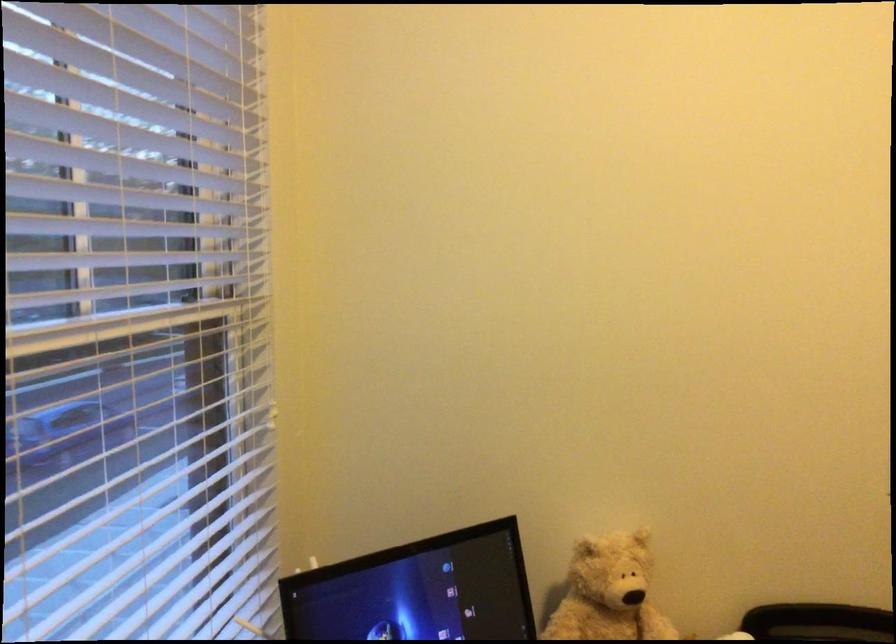
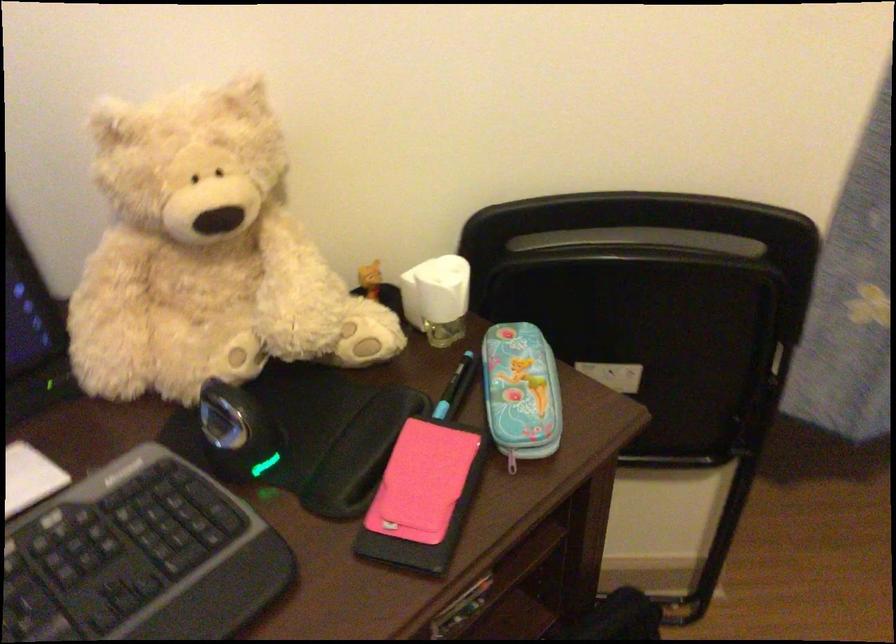
Question: Based on the continuous images, in which direction is the camera rotating? Reply with the corresponding letter.

Choices:
 (A) Left
 (B) Right
 (C) Up
 (D) Down

Answer: (D)